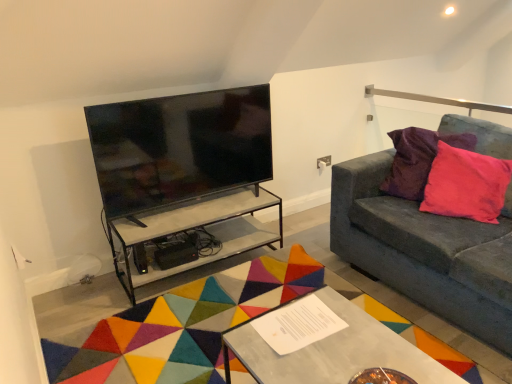
Find the location of `free point in front of white paper at center`. free point in front of white paper at center is located at coordinates (306, 361).